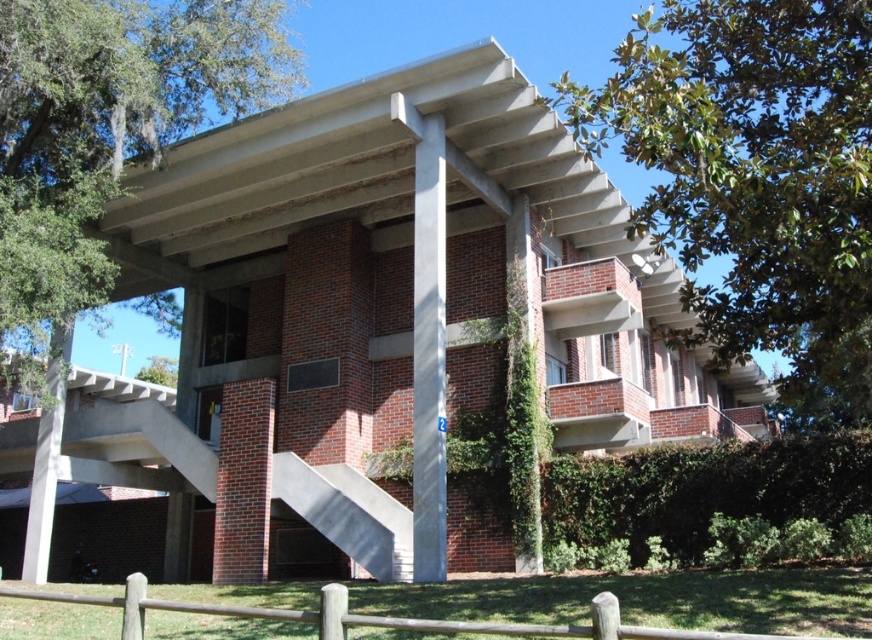
Question: Does brown wooden fence at lower center appear on the right side of concrete/stained at lower center?

Choices:
 (A) yes
 (B) no

Answer: (B)

Question: Is concrete/stained at lower center behind concrete at left?

Choices:
 (A) no
 (B) yes

Answer: (A)

Question: From the image, what is the correct spatial relationship of concrete/stained at lower center in relation to concrete at left?

Choices:
 (A) right
 (B) left

Answer: (A)

Question: Which object is farther from the camera taking this photo?

Choices:
 (A) brown wooden fence at lower center
 (B) white marble pillar at center
 (C) concrete at left
 (D) green leafy tree at upper left

Answer: (C)

Question: Which of the following is the closest to the observer?

Choices:
 (A) green leafy tree at upper right
 (B) concrete/stained at lower center
 (C) white marble pillar at center

Answer: (A)

Question: Which of the following is the farthest from the observer?

Choices:
 (A) (58, 403)
 (B) (11, 280)
 (C) (301, 476)

Answer: (A)